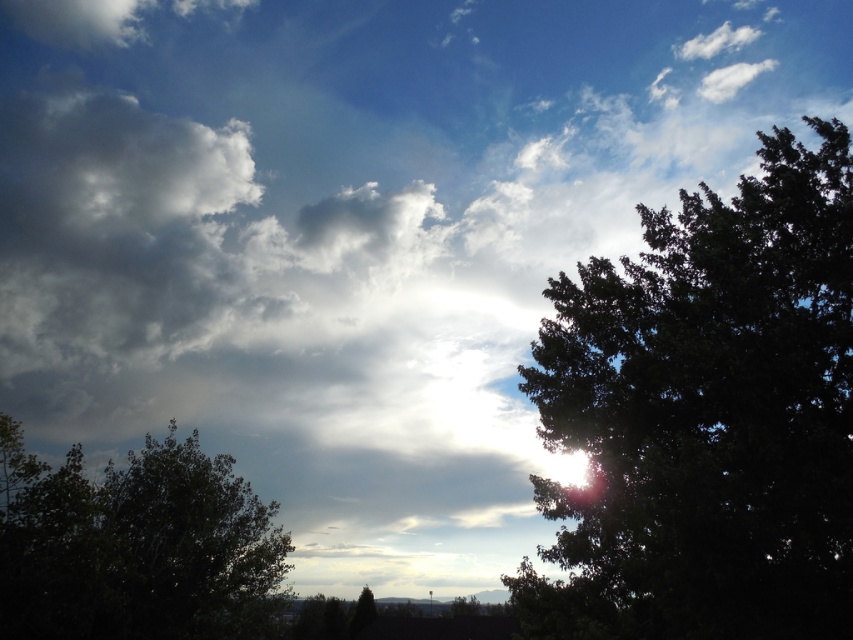
Which of these two, green leafy tree at right or dark green leafy tree at lower left, stands taller?

green leafy tree at right

Does green leafy tree at right have a greater width compared to dark green leafy tree at lower left?

Yes.

The width and height of the screenshot is (853, 640). In order to click on green leafy tree at right in this screenshot , I will do `click(706, 417)`.

Identify the location of green leafy tree at right. (706, 417).